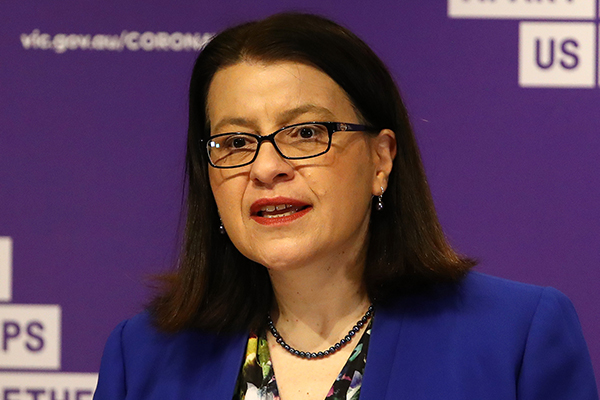
Image resolution: width=600 pixels, height=400 pixels. I want to click on purple wall, so click(x=468, y=166).